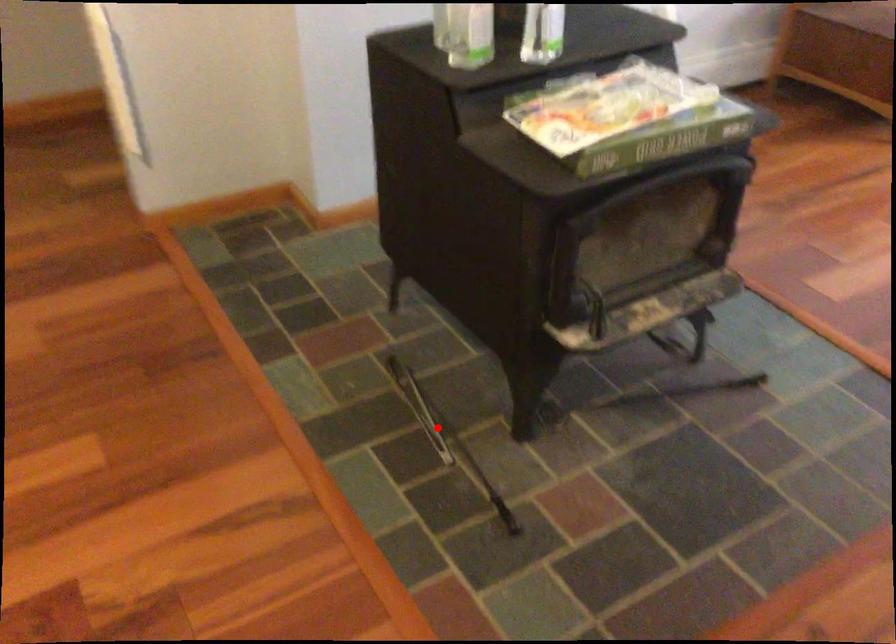
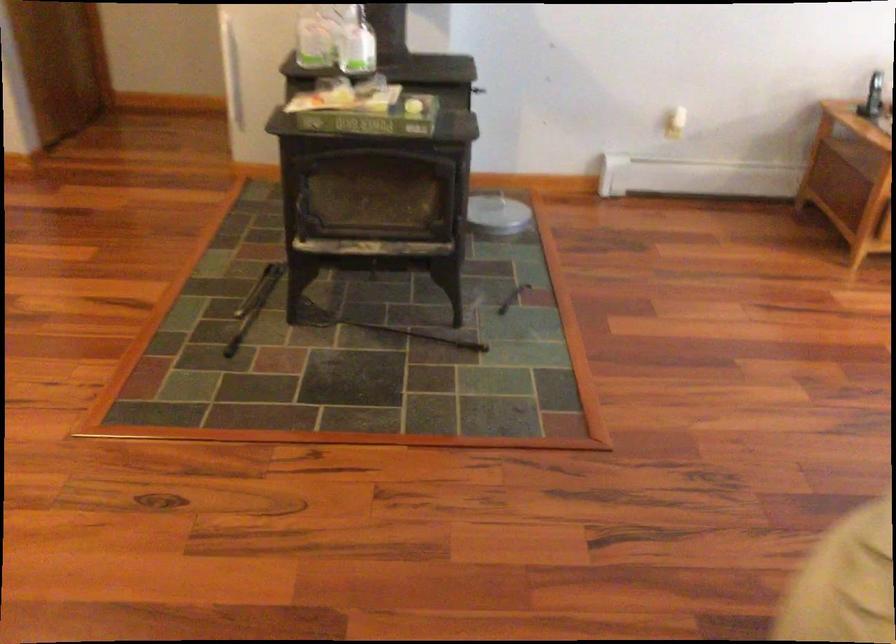
The point at the highlighted location is marked in the first image. Where is the corresponding point in the second image?

(254, 305)